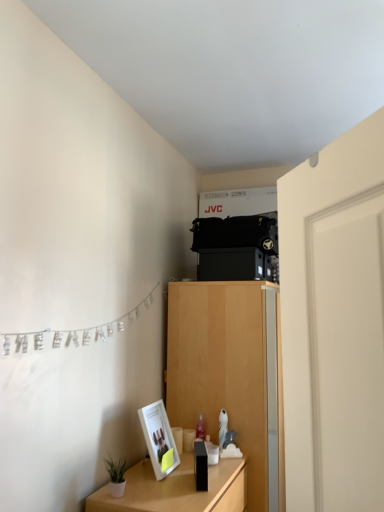
Question: Should I look upward or downward to see white smooth door at right?

Choices:
 (A) down
 (B) up

Answer: (A)

Question: Does white smooth door at right contain light wood cabinet at center?

Choices:
 (A) no
 (B) yes

Answer: (A)

Question: Is white smooth door at right to the left of light wood cabinet at center from the viewer's perspective?

Choices:
 (A) yes
 (B) no

Answer: (B)

Question: Can you confirm if white smooth door at right is thinner than light wood cabinet at center?

Choices:
 (A) yes
 (B) no

Answer: (A)

Question: From a real-world perspective, is white smooth door at right positioned over light wood cabinet at center based on gravity?

Choices:
 (A) no
 (B) yes

Answer: (B)

Question: From the image's perspective, is white smooth door at right above light wood cabinet at center?

Choices:
 (A) yes
 (B) no

Answer: (A)

Question: Is white smooth door at right located outside light wood cabinet at center?

Choices:
 (A) no
 (B) yes

Answer: (B)

Question: From the image's perspective, is matte white picture frame at lower left located beneath light wood cabinet at center?

Choices:
 (A) no
 (B) yes

Answer: (A)

Question: From a real-world perspective, is matte white picture frame at lower left physically below light wood cabinet at center?

Choices:
 (A) yes
 (B) no

Answer: (B)

Question: Is matte white picture frame at lower left at the right side of light wood cabinet at center?

Choices:
 (A) no
 (B) yes

Answer: (A)

Question: Can you confirm if matte white picture frame at lower left is wider than light wood cabinet at center?

Choices:
 (A) yes
 (B) no

Answer: (B)

Question: Could light wood cabinet at center be considered to be inside matte white picture frame at lower left?

Choices:
 (A) yes
 (B) no

Answer: (B)

Question: Is matte white picture frame at lower left behind light wood cabinet at center?

Choices:
 (A) yes
 (B) no

Answer: (B)

Question: Could you tell me if silver metallic banner at left is turned towards wooden table at lower left?

Choices:
 (A) no
 (B) yes

Answer: (A)